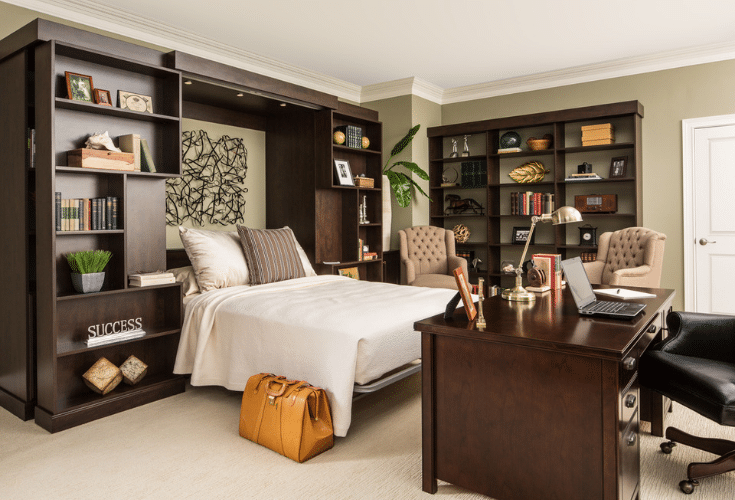
The height and width of the screenshot is (500, 735). What are the coordinates of `white ceiling` in the screenshot? It's located at (408, 36).